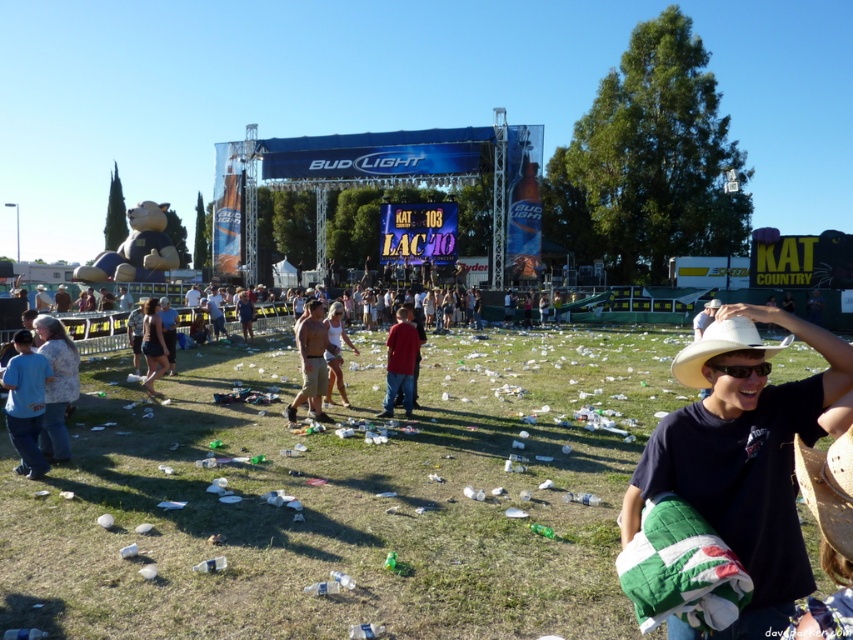
You are a cleanup crew member assigned to collect items from the stage area. You need to retrieve an item located at point (740, 369). According to the image, what object is at this coordinate?

The point (740, 369) is on black plastic goggles at center, so the object at this coordinate is the black plastic goggles at center.

You are a stagehand at the event and need to retrieve both the light brown hair at center and the tan cotton shorts at center from the stage area. If you can carry items within a 3 meter radius, which item would you need to move first to stay within your carrying range?

The light brown hair at center is 4.30 meters away from the tan cotton shorts at center. Since the distance between them exceeds your 3 meter carrying radius, you would need to move one item closer to the other first. However, since you need to retrieve both, you might prioritize whichever is closer to your starting position, but the question doesn,t specify your location. Alternatively, the question might be implying that you can only carry items within 3m of each other, so you must move them to within 3m.